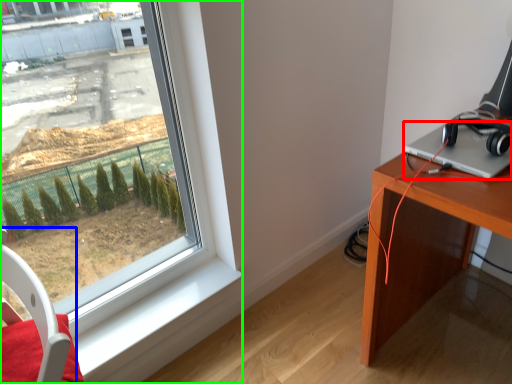
Question: Which object is the farthest from laptop (highlighted by a red box)? Choose among these: swivel chair (highlighted by a blue box) or window (highlighted by a green box).

Choices:
 (A) swivel chair
 (B) window

Answer: (A)